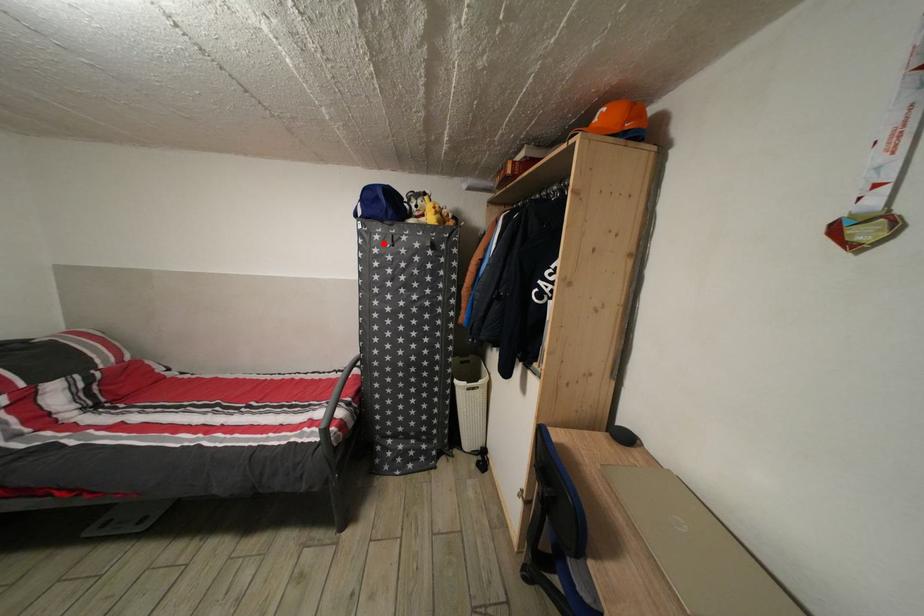
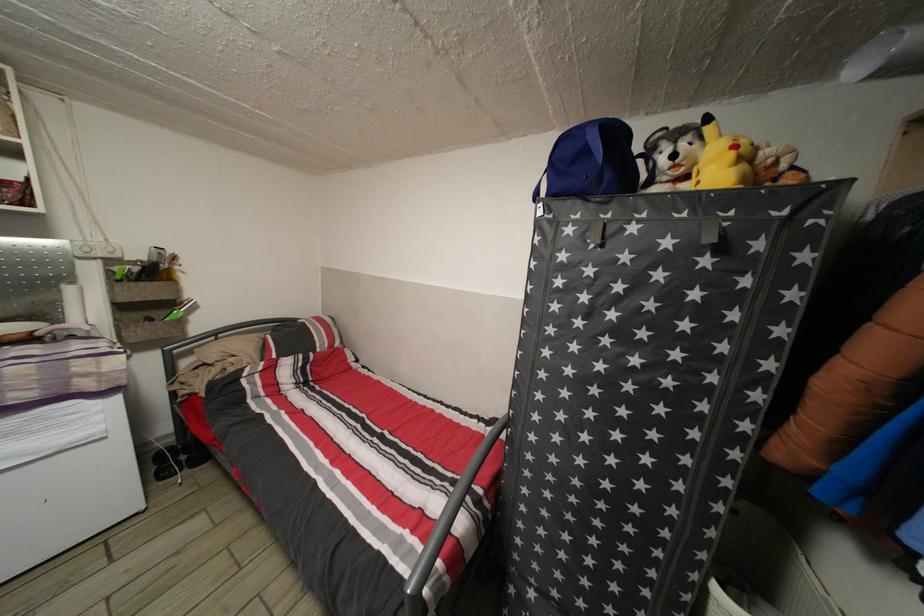
Find the pixel in the second image that matches the highlighted location in the first image.

(576, 237)